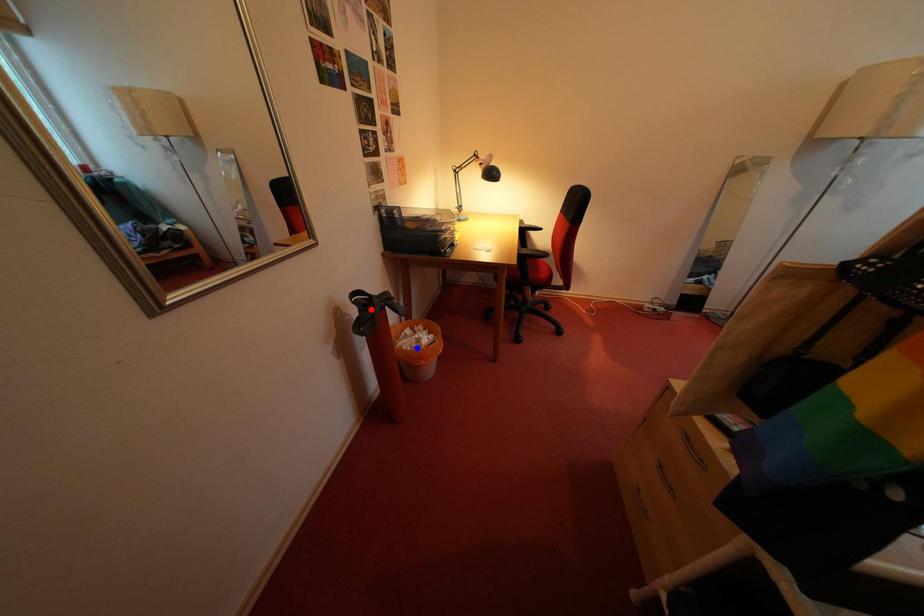
Question: Which of the two points in the image is closer to the camera?

Choices:
 (A) Blue point is closer.
 (B) Red point is closer.

Answer: (B)